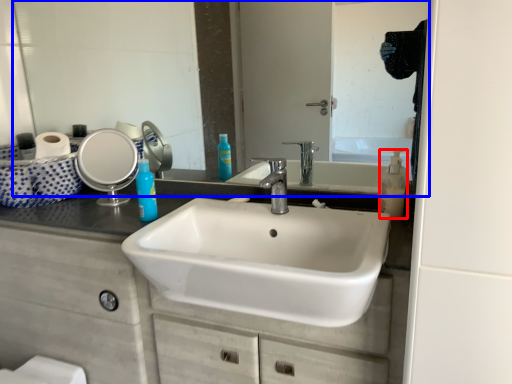
Question: Which object is closer to the camera taking this photo, soap dispenser (highlighted by a red box) or mirror (highlighted by a blue box)?

Choices:
 (A) soap dispenser
 (B) mirror

Answer: (B)